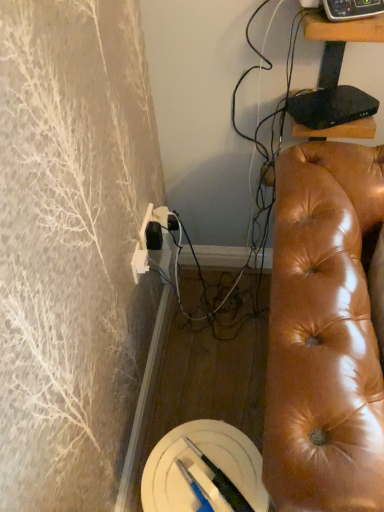
Question: From the image's perspective, is shiny brown leather couch at right under black glossy tv stand at upper right?

Choices:
 (A) yes
 (B) no

Answer: (A)

Question: Is shiny brown leather couch at right outside black glossy tv stand at upper right?

Choices:
 (A) no
 (B) yes

Answer: (B)

Question: Is the position of shiny brown leather couch at right less distant than that of black glossy tv stand at upper right?

Choices:
 (A) no
 (B) yes

Answer: (B)

Question: Does shiny brown leather couch at right turn towards black glossy tv stand at upper right?

Choices:
 (A) no
 (B) yes

Answer: (A)

Question: From a real-world perspective, does shiny brown leather couch at right sit lower than black glossy tv stand at upper right?

Choices:
 (A) yes
 (B) no

Answer: (A)

Question: Considering the positions of point click(360, 14) and point click(360, 123), is point click(360, 14) closer or farther from the camera than point click(360, 123)?

Choices:
 (A) closer
 (B) farther

Answer: (A)

Question: From a real-world perspective, is black plastic remote control at upper right above or below black glossy tv stand at upper right?

Choices:
 (A) below
 (B) above

Answer: (B)

Question: Is black plastic remote control at upper right inside or outside of black glossy tv stand at upper right?

Choices:
 (A) inside
 (B) outside

Answer: (B)

Question: From the image's perspective, relative to black glossy tv stand at upper right, is black plastic remote control at upper right above or below?

Choices:
 (A) below
 (B) above

Answer: (B)

Question: In the image, is black plastic remote control at upper right positioned in front of or behind shiny brown leather couch at right?

Choices:
 (A) behind
 (B) front

Answer: (A)

Question: Does point (355, 12) appear closer or farther from the camera than point (322, 464)?

Choices:
 (A) closer
 (B) farther

Answer: (B)

Question: Considering the positions of black plastic remote control at upper right and shiny brown leather couch at right in the image, is black plastic remote control at upper right wider or thinner than shiny brown leather couch at right?

Choices:
 (A) thin
 (B) wide

Answer: (A)

Question: Would you say black plastic remote control at upper right is inside or outside shiny brown leather couch at right?

Choices:
 (A) inside
 (B) outside

Answer: (B)

Question: In terms of height, does black glossy tv stand at upper right look taller or shorter compared to shiny brown leather couch at right?

Choices:
 (A) short
 (B) tall

Answer: (A)

Question: Is black glossy tv stand at upper right wider or thinner than shiny brown leather couch at right?

Choices:
 (A) wide
 (B) thin

Answer: (A)